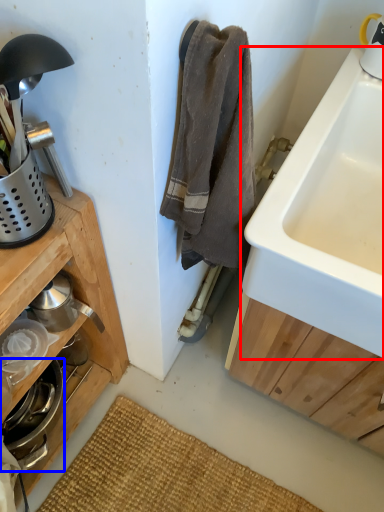
Question: Which point is closer to the camera, sink (highlighted by a red box) or appliance (highlighted by a blue box)?

Choices:
 (A) sink
 (B) appliance

Answer: (A)